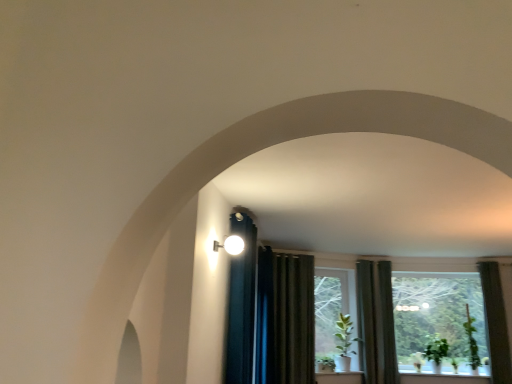
Question: Are dark green fabric curtain at right, arranged as the 1th curtain when viewed from the right, and green fabric curtain at right, which is the second curtain in right-to-left order, located far from each other?

Choices:
 (A) yes
 (B) no

Answer: (A)

Question: Could you tell me if dark green fabric curtain at right, positioned as the 3th curtain in left-to-right order, is turned towards green fabric curtain at right, which is the second curtain in right-to-left order?

Choices:
 (A) no
 (B) yes

Answer: (A)

Question: Is dark green fabric curtain at right, positioned as the 3th curtain in left-to-right order, to the right of green fabric curtain at right, the second curtain viewed from the left, from the viewer's perspective?

Choices:
 (A) yes
 (B) no

Answer: (A)

Question: Is dark green fabric curtain at right, arranged as the 1th curtain when viewed from the right, completely or partially outside of green fabric curtain at right, the second curtain viewed from the left?

Choices:
 (A) no
 (B) yes

Answer: (B)

Question: Can you confirm if dark green fabric curtain at right, arranged as the 1th curtain when viewed from the right, is thinner than green fabric curtain at right, the second curtain viewed from the left?

Choices:
 (A) yes
 (B) no

Answer: (A)

Question: Does dark green fabric curtain at right, arranged as the 1th curtain when viewed from the right, have a greater height compared to green fabric curtain at right, which is the second curtain in right-to-left order?

Choices:
 (A) yes
 (B) no

Answer: (B)

Question: Does transparent glass window at center have a lesser width compared to green matte plant at lower right, which appears as the 2th plant when viewed from the right?

Choices:
 (A) yes
 (B) no

Answer: (A)

Question: Does transparent glass window at center have a smaller size compared to green matte plant at lower right, which appears as the 2th plant when viewed from the right?

Choices:
 (A) yes
 (B) no

Answer: (B)

Question: From the image's perspective, is transparent glass window at center on top of green matte plant at lower right, which is the first plant from left to right?

Choices:
 (A) yes
 (B) no

Answer: (A)

Question: Can you confirm if transparent glass window at center is positioned to the left of green matte plant at lower right, which appears as the 2th plant when viewed from the right?

Choices:
 (A) yes
 (B) no

Answer: (B)

Question: Is transparent glass window at center positioned with its back to green matte plant at lower right, which is the first plant from left to right?

Choices:
 (A) yes
 (B) no

Answer: (A)

Question: Does transparent glass window at center have a greater height compared to green matte plant at lower right, which is the first plant from left to right?

Choices:
 (A) no
 (B) yes

Answer: (B)

Question: Would you say green matte plant at center is a long distance from green matte plant at center?

Choices:
 (A) no
 (B) yes

Answer: (A)